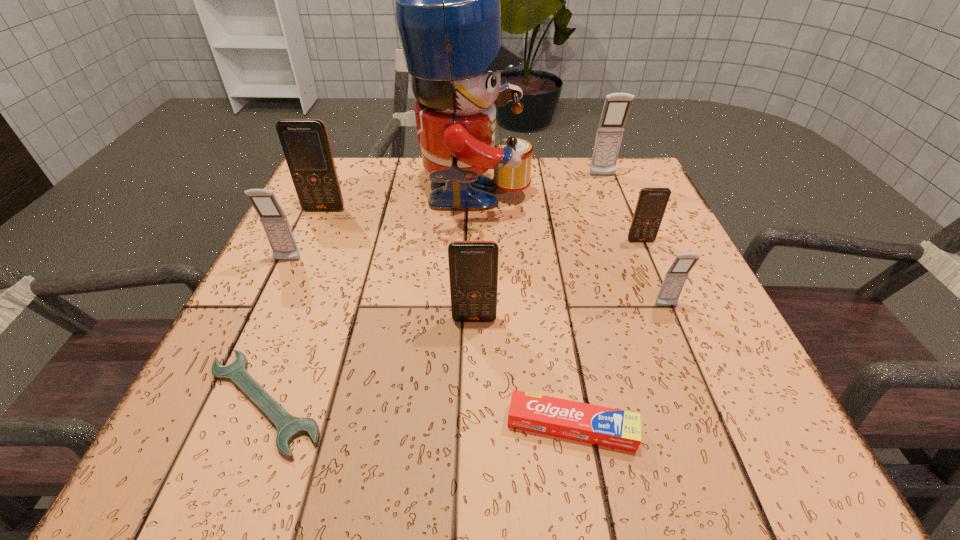
Locate an element on the screen. This screenshot has height=540, width=960. object that is at the near left corner is located at coordinates (289, 427).

Locate an element on the screen. object at the far right corner is located at coordinates [x=616, y=108].

This screenshot has height=540, width=960. In order to click on vacant space at the far edge in this screenshot , I will do `click(393, 193)`.

This screenshot has width=960, height=540. Find the location of `vacant region at the near edge of the desktop`. vacant region at the near edge of the desktop is located at coordinates (445, 420).

Image resolution: width=960 pixels, height=540 pixels. I want to click on blank area at the left edge, so click(214, 404).

Locate an element on the screen. The height and width of the screenshot is (540, 960). blank space at the right edge is located at coordinates (675, 233).

This screenshot has width=960, height=540. I want to click on free space at the far left corner of the desktop, so click(348, 184).

Identify the location of vacant space at the near left corner. (202, 427).

At what (x,y) coordinates should I click in order to perform the action: click on blank area at the near right corner. Please return your answer as a coordinate pair (x, y). The height and width of the screenshot is (540, 960). Looking at the image, I should click on (711, 444).

Identify the location of vacant area between the second farthest cellular telephone and the second biggest gray cellular telephone. The width and height of the screenshot is (960, 540). (306, 235).